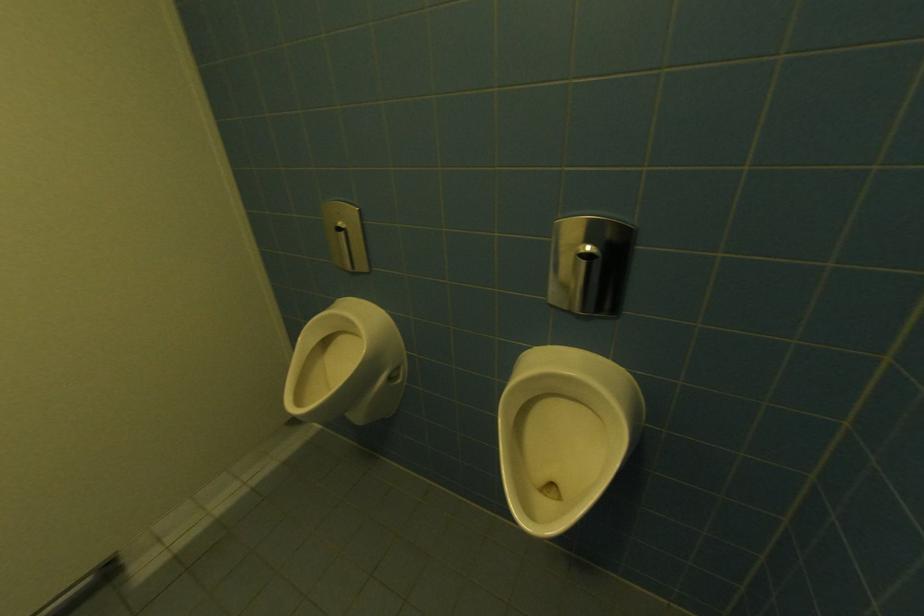
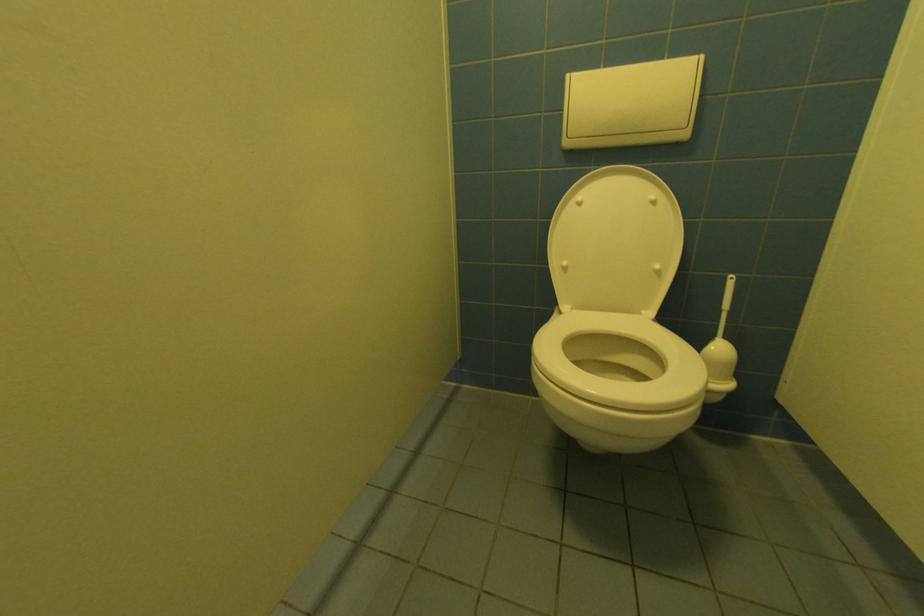
Based on the photo, in a continuous first-person perspective shot, in which direction is the camera moving?

The cameraman walked toward left, forward.